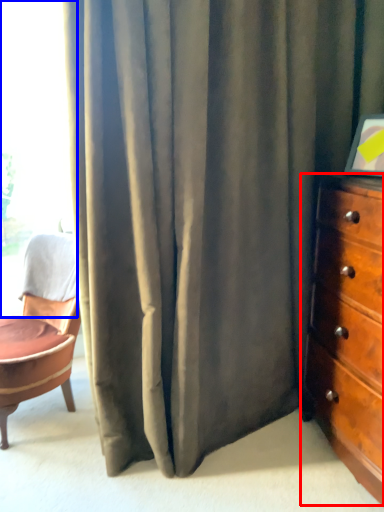
Question: Which object is closer to the camera taking this photo, chest of drawers (highlighted by a red box) or window (highlighted by a blue box)?

Choices:
 (A) chest of drawers
 (B) window

Answer: (A)